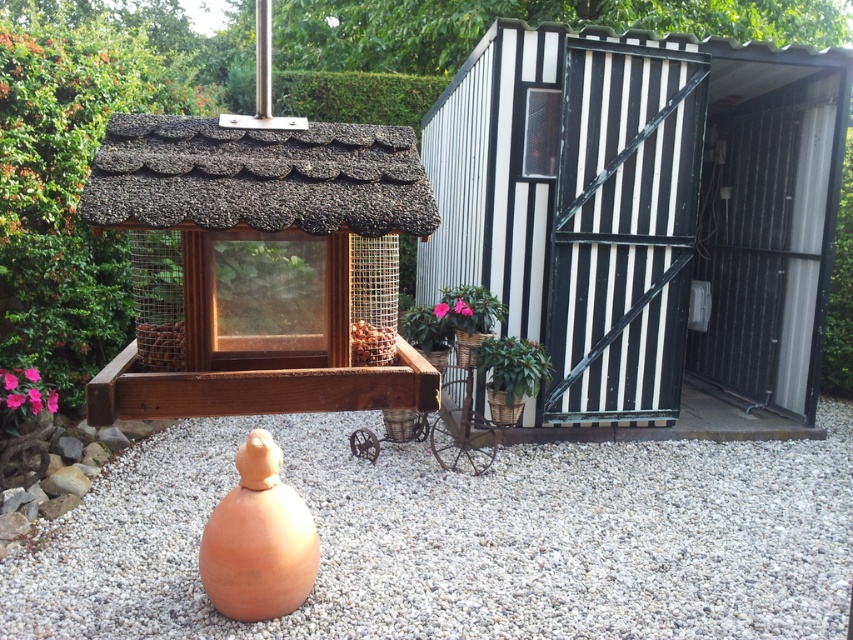
Is green matte plant at lower center below pink matte flower at lower left?

Actually, green matte plant at lower center is above pink matte flower at lower left.

Which is in front, point (515, 385) or point (38, 372)?

Point (38, 372) is more forward.

This screenshot has height=640, width=853. What are the coordinates of `green matte plant at lower center` in the screenshot? It's located at (514, 365).

Does green leafy plant at upper left lie behind pink glossy flower pot at center?

Yes, green leafy plant at upper left is further from the viewer.

The image size is (853, 640). What are the coordinates of `green leafy plant at upper left` in the screenshot? It's located at (74, 170).

Locate an element on the screen. This screenshot has width=853, height=640. green leafy plant at upper left is located at coordinates (74, 170).

Which is behind, point (590, 426) or point (42, 241)?

Positioned behind is point (590, 426).

Is point (625, 342) positioned behind point (167, 90)?

That is False.

The width and height of the screenshot is (853, 640). Find the location of `black corrugated metal shed at center`. black corrugated metal shed at center is located at coordinates (643, 212).